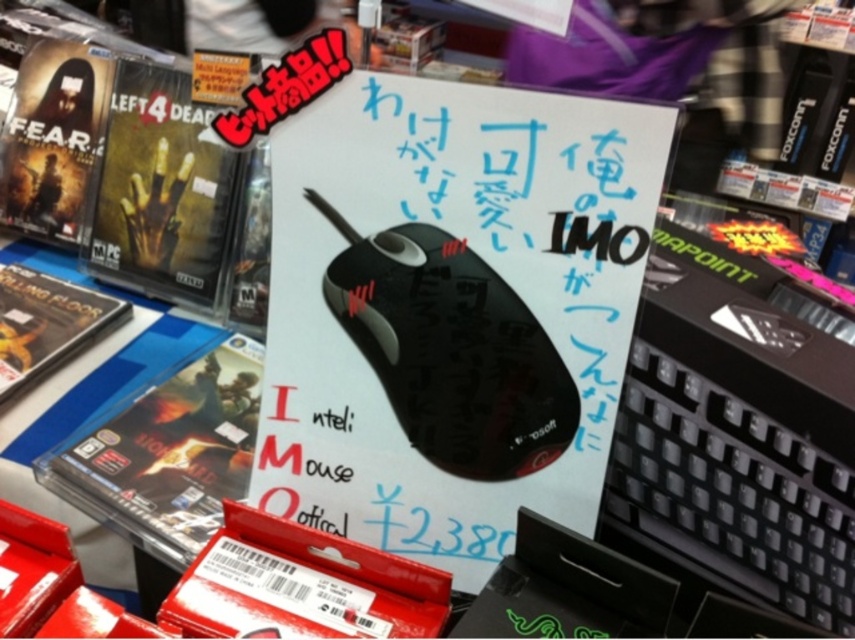
Is black plastic keyboard at center-right wider than black matte optical mouse at center?

No.

Can you confirm if black plastic keyboard at center-right is positioned to the right of black matte optical mouse at center?

Indeed, black plastic keyboard at center-right is positioned on the right side of black matte optical mouse at center.

Which is in front, point (705, 515) or point (384, 248)?

Point (705, 515)

Find the location of `black plastic keyboard at center-right`. black plastic keyboard at center-right is located at coordinates (730, 492).